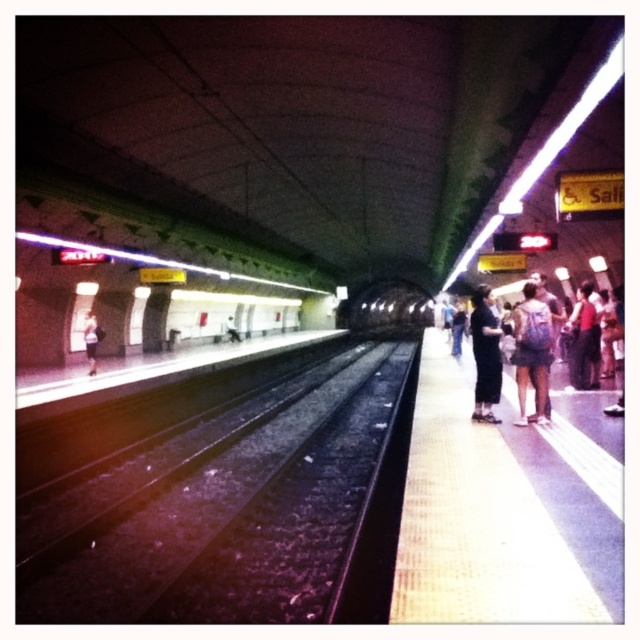
Consider the image. You are standing on the subway platform and want to locate the yellow textured platform at right. According to the coordinates provided, where should you look relative to your current position?

The yellow textured platform at right is located at coordinates point (496, 516), which means it is positioned to the upper right relative to your current position.

You are a commuter standing on the subway platform. You notice a blue backpack at right and dark blue jeans at left. Which object appears taller in the image?

The blue backpack at right is taller than the dark blue jeans at left.

You are a person standing on the subway platform and you have a blue backpack at right and dark blue jeans at left. If you want to place both items on the ground next to you, which item requires more horizontal space?

The blue backpack at right requires more horizontal space because its width is larger than the dark blue jeans at left.